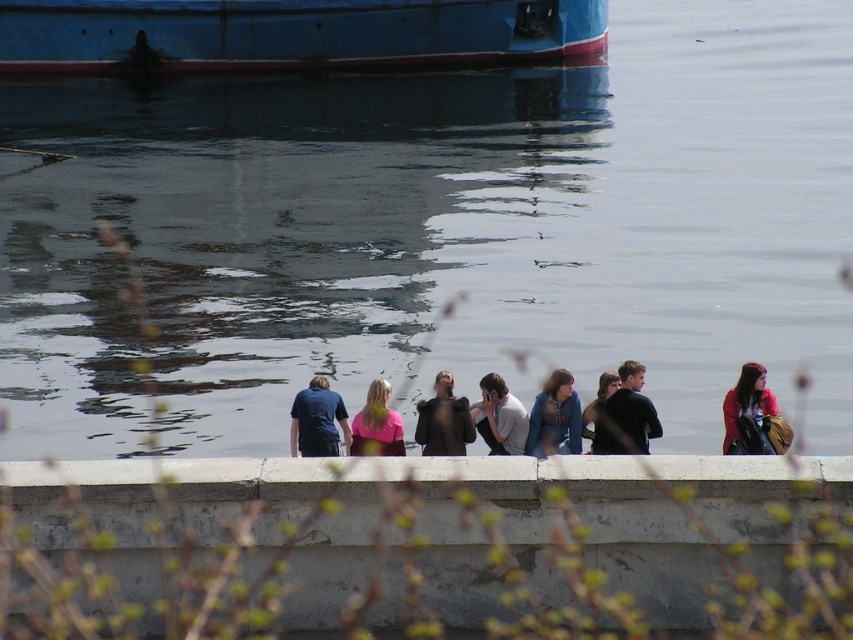
Which is below, blue painted wood boat at upper left or light gray fabric shirt at center?

light gray fabric shirt at center

Consider the image. Is blue painted wood boat at upper left taller than light gray fabric shirt at center?

Yes.

Between point (387, 45) and point (492, 403), which one is positioned behind?

Positioned behind is point (387, 45).

Locate an element on the screen. This screenshot has width=853, height=640. blue painted wood boat at upper left is located at coordinates (289, 35).

Where is `dark blue fabric shirt at center`? This screenshot has width=853, height=640. dark blue fabric shirt at center is located at coordinates (317, 420).

Is blue painted wood boat at upper left above dark blue shirt at center?

Indeed, blue painted wood boat at upper left is positioned over dark blue shirt at center.

Between blue painted wood boat at upper left and dark blue shirt at center, which one appears on the left side from the viewer's perspective?

Positioned to the left is blue painted wood boat at upper left.

Is point (91, 12) positioned before point (596, 422)?

No, (91, 12) is further to viewer.

I want to click on blue painted wood boat at upper left, so click(289, 35).